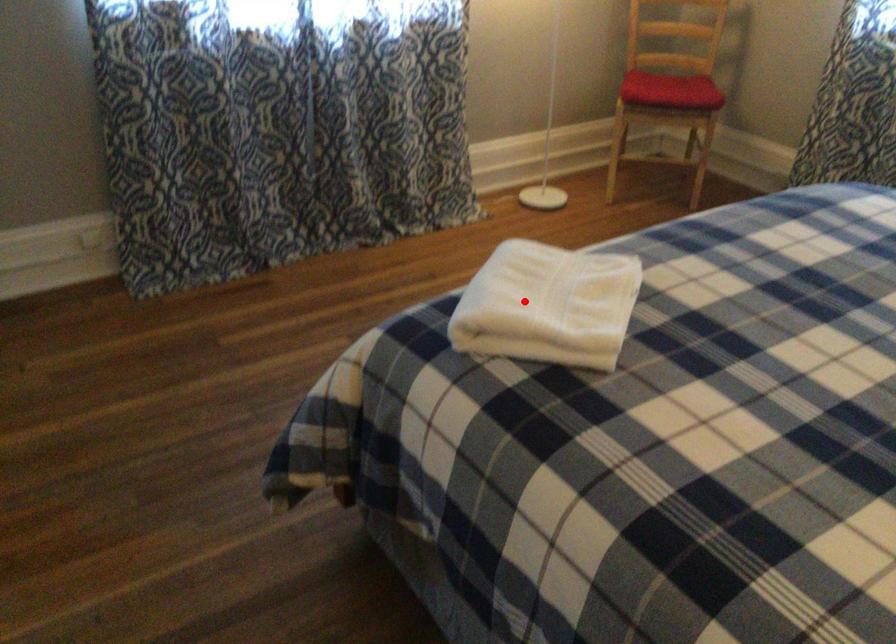
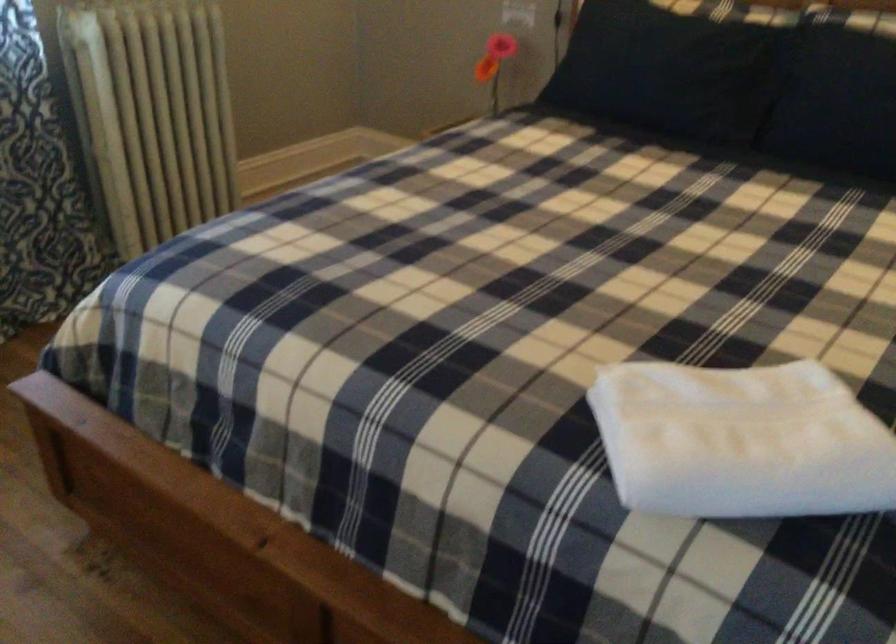
Find the pixel in the second image that matches the highlighted location in the first image.

(741, 440)